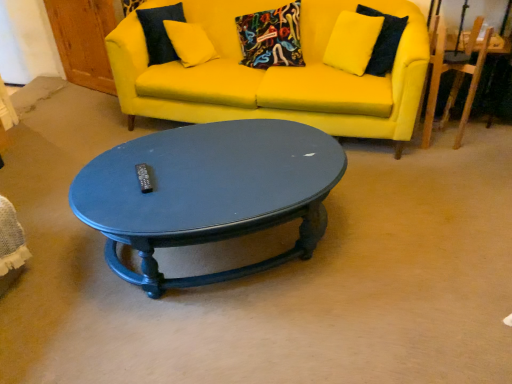
The width and height of the screenshot is (512, 384). In order to click on free spot in front of glossy dark blue coffee table at center in this screenshot , I will do `click(231, 339)`.